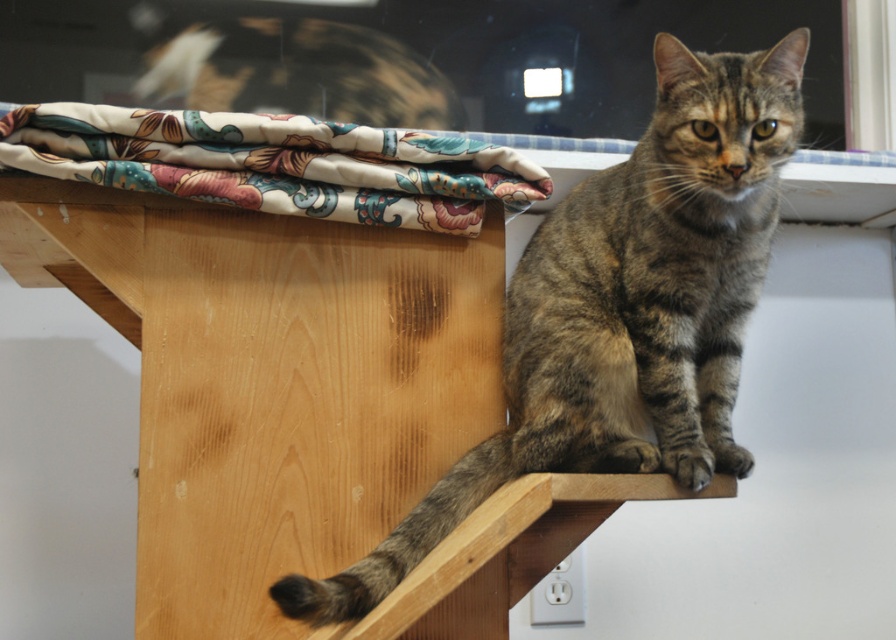
Who is positioned more to the right, tabby fur cat at center or floral fabric at upper left?

From the viewer's perspective, tabby fur cat at center appears more on the right side.

Which of these two, tabby fur cat at center or floral fabric at upper left, stands shorter?

With less height is floral fabric at upper left.

Between point (514, 465) and point (29, 152), which one is positioned in front?

Positioned in front is point (29, 152).

The image size is (896, 640). Identify the location of tabby fur cat at center. 623,310.